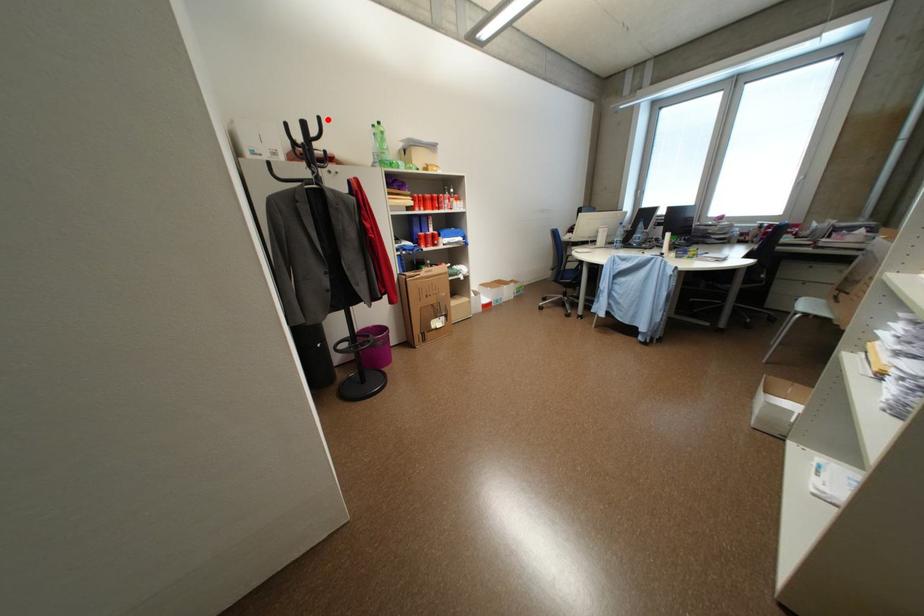
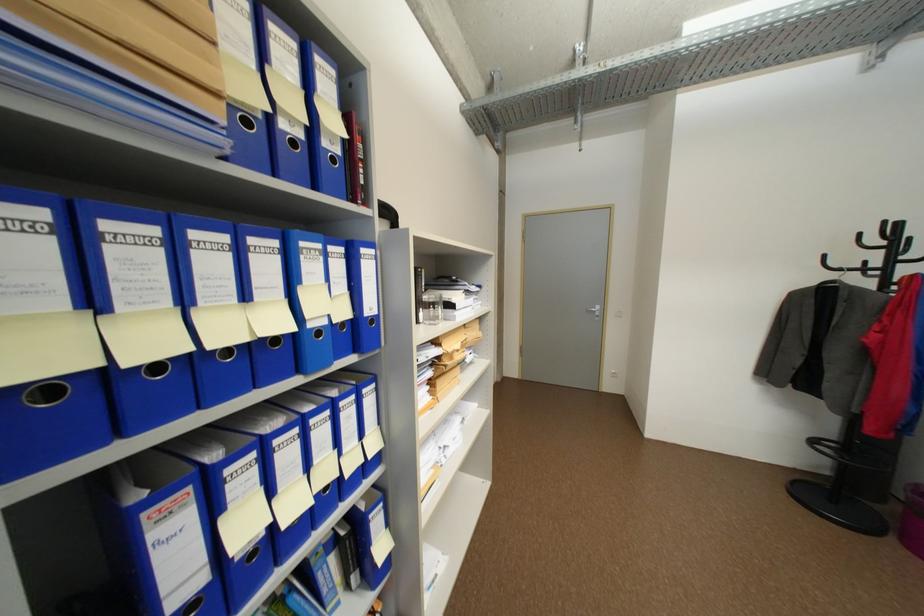
Locate, in the second image, the point that corresponds to the highlighted location in the first image.

(893, 224)